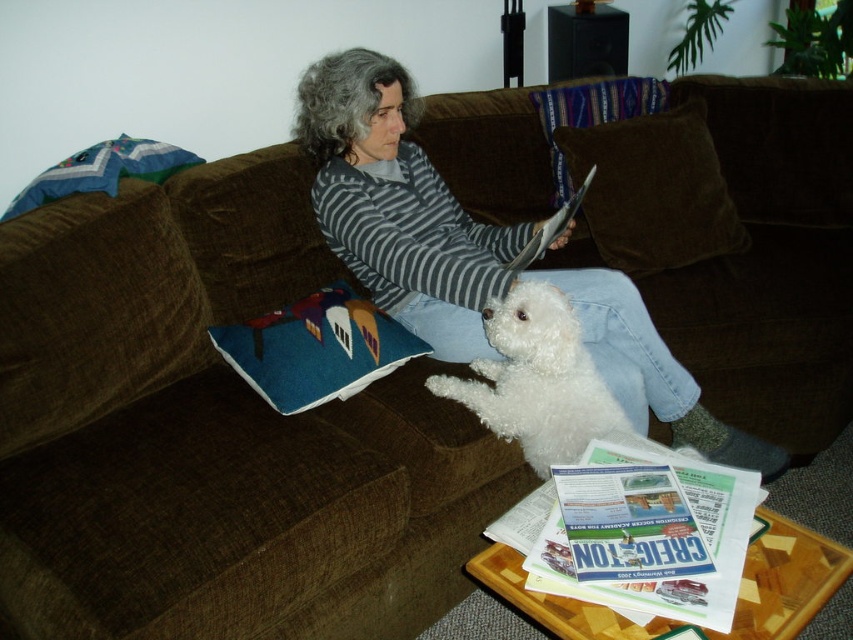
You are a tailor who needs to determine if a striped cotton sweater at center can fit into a storage box designed for the matte paper magazine at center. The box is exactly the size of the magazine. Can the sweater fit?

The striped cotton sweater at center might be wider than matte paper magazine at center, so it may not fit into the box designed for the magazine.

Based on the scene description, can you determine which object is closer to the viewer between the white fluffy dog at center and the matte paper magazine at center?

The white fluffy dog at center is closer to the viewer than the matte paper magazine at center because it is positioned in front of it.

You are a photographer trying to capture a clear shot of both the white fluffy dog at center and the matte paper magazine at center. Since you want both subjects in focus, you need to ensure they are at the same height. Given their current heights, which subject should you adjust to match the other?

The white fluffy dog at center is taller than the matte paper magazine at center. To make them the same height, you should lower the white fluffy dog at center or raise the matte paper magazine at center.